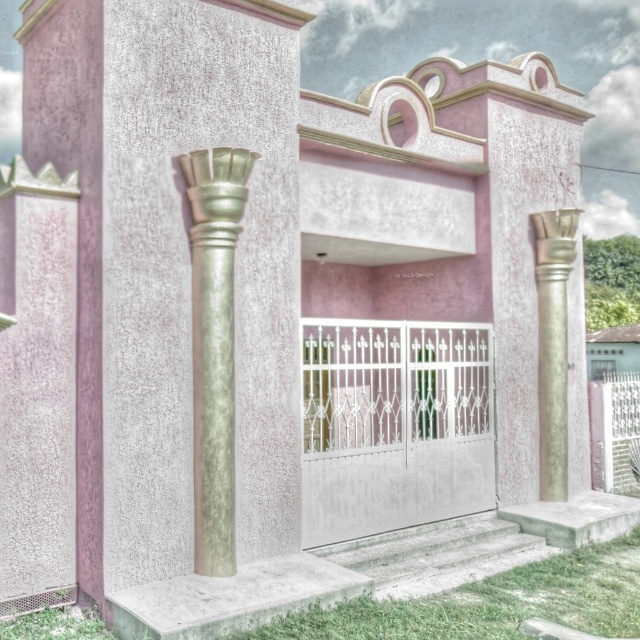
You are an architect assessing the structural integrity of the columns in the building. Given that the green marble column at left and the gold textured column at right are both supporting the entrance, which column would you recommend reinforcing if one is significantly wider than the other?

The green marble column at left might be wider than gold textured column at right, so if one is significantly wider, it would likely require reinforcement to ensure balanced load distribution.

You are standing in front of the building and notice a point marked at coordinates (212, 346). Which object does this point correspond to?

The point at coordinates (212, 346) corresponds to the green marble column at left.

You are standing in front of the building and want to take a photo of the entrance. Which column, the green marble column at left or the gold textured column at right, will appear closer to the camera in your photo?

The green marble column at left will appear closer to the camera in your photo because it is positioned in front of the gold textured column at right.